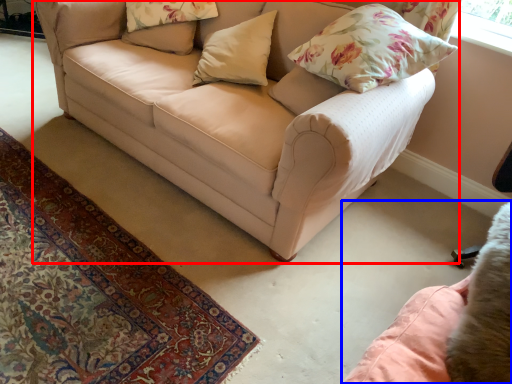
Question: Which object is closer to the camera taking this photo, studio couch (highlighted by a red box) or swivel chair (highlighted by a blue box)?

Choices:
 (A) studio couch
 (B) swivel chair

Answer: (B)